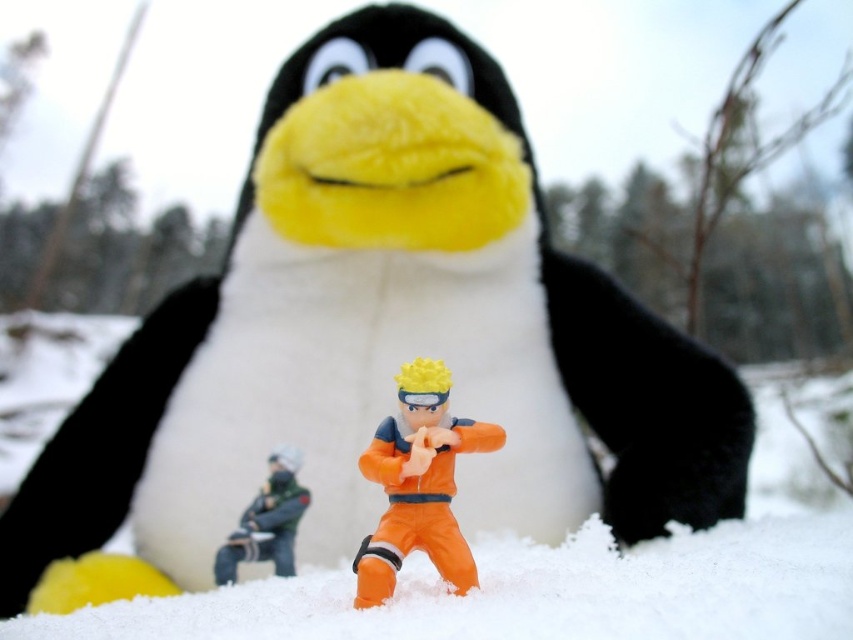
Is white fluffy snow at center positioned behind orange matte toy at center?

No, white fluffy snow at center is in front of orange matte toy at center.

Based on the photo, is white fluffy snow at center taller than orange matte toy at center?

In fact, white fluffy snow at center may be shorter than orange matte toy at center.

Is point (752, 624) closer to viewer compared to point (450, 486)?

Yes, it is in front of point (450, 486).

The height and width of the screenshot is (640, 853). I want to click on white fluffy snow at center, so click(x=578, y=566).

Who is more distant from viewer, (x=465, y=586) or (x=293, y=493)?

The point (x=293, y=493) is behind.

Is orange matte toy at center to the right of orange plastic toy at center from the viewer's perspective?

Indeed, orange matte toy at center is positioned on the right side of orange plastic toy at center.

Who is more forward, (445, 449) or (291, 492)?

Point (445, 449) is in front.

The width and height of the screenshot is (853, 640). Identify the location of orange matte toy at center. (418, 483).

Is point (773, 372) less distant than point (276, 563)?

No, it is behind (276, 563).

Which is in front, point (833, 621) or point (285, 515)?

Positioned in front is point (833, 621).

This screenshot has height=640, width=853. I want to click on white fluffy snow at center, so click(x=578, y=566).

The image size is (853, 640). Find the location of `white fluffy snow at center`. white fluffy snow at center is located at coordinates point(578,566).